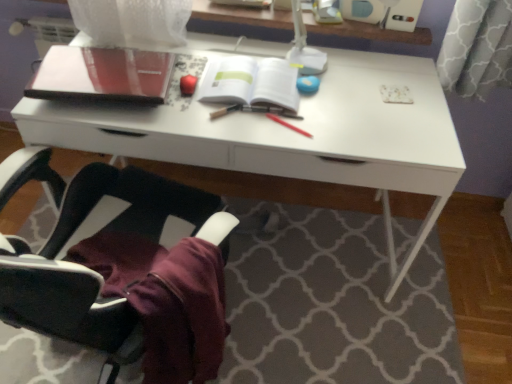
Question: Is matte black notebook at upper left beside glossy red apple at upper center, which ranks as the first stationery in left-to-right order?

Choices:
 (A) yes
 (B) no

Answer: (B)

Question: Can you confirm if matte black notebook at upper left is taller than glossy red apple at upper center, which ranks as the first stationery in left-to-right order?

Choices:
 (A) yes
 (B) no

Answer: (A)

Question: Is matte black notebook at upper left positioned with its back to glossy red apple at upper center, marked as the third stationery in a right-to-left arrangement?

Choices:
 (A) no
 (B) yes

Answer: (A)

Question: Is glossy red apple at upper center, which ranks as the first stationery in left-to-right order, completely or partially inside matte black notebook at upper left?

Choices:
 (A) no
 (B) yes

Answer: (A)

Question: From a real-world perspective, is matte black notebook at upper left over glossy red apple at upper center, which ranks as the first stationery in left-to-right order?

Choices:
 (A) yes
 (B) no

Answer: (A)

Question: Considering the positions of white glossy desk at center and black fabric chair at lower left in the image, is white glossy desk at center taller or shorter than black fabric chair at lower left?

Choices:
 (A) tall
 (B) short

Answer: (B)

Question: From the image's perspective, is white glossy desk at center located above or below black fabric chair at lower left?

Choices:
 (A) above
 (B) below

Answer: (A)

Question: From a real-world perspective, is white glossy desk at center physically located above or below black fabric chair at lower left?

Choices:
 (A) above
 (B) below

Answer: (B)

Question: Is white glossy desk at center wider or thinner than black fabric chair at lower left?

Choices:
 (A) wide
 (B) thin

Answer: (B)

Question: Is point (108, 62) positioned closer to the camera than point (226, 102)?

Choices:
 (A) closer
 (B) farther

Answer: (B)

Question: Choose the correct answer: Is matte black notebook at upper left inside white paper at center or outside it?

Choices:
 (A) inside
 (B) outside

Answer: (B)

Question: Based on their positions, is matte black notebook at upper left located to the left or right of white paper at center?

Choices:
 (A) right
 (B) left

Answer: (B)

Question: In terms of size, does matte black notebook at upper left appear bigger or smaller than white paper at center?

Choices:
 (A) big
 (B) small

Answer: (A)

Question: Considering the positions of black fabric chair at lower left and red matte pen at center, which is the first stationery from right to left, in the image, is black fabric chair at lower left taller or shorter than red matte pen at center, which is the first stationery from right to left,?

Choices:
 (A) tall
 (B) short

Answer: (A)

Question: In the image, is black fabric chair at lower left positioned in front of or behind red matte pen at center, positioned as the 3th stationery in left-to-right order?

Choices:
 (A) behind
 (B) front

Answer: (B)